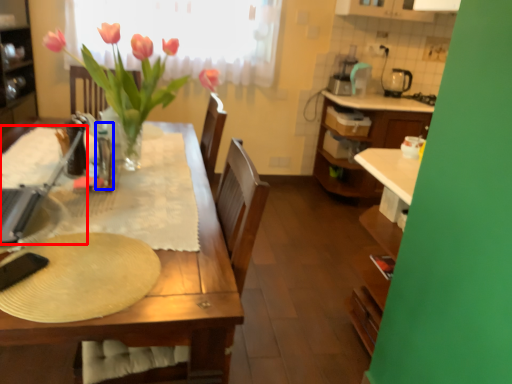
Question: Which object appears closest to the camera in this image, appliance (highlighted by a red box) or bottle (highlighted by a blue box)?

Choices:
 (A) appliance
 (B) bottle

Answer: (A)